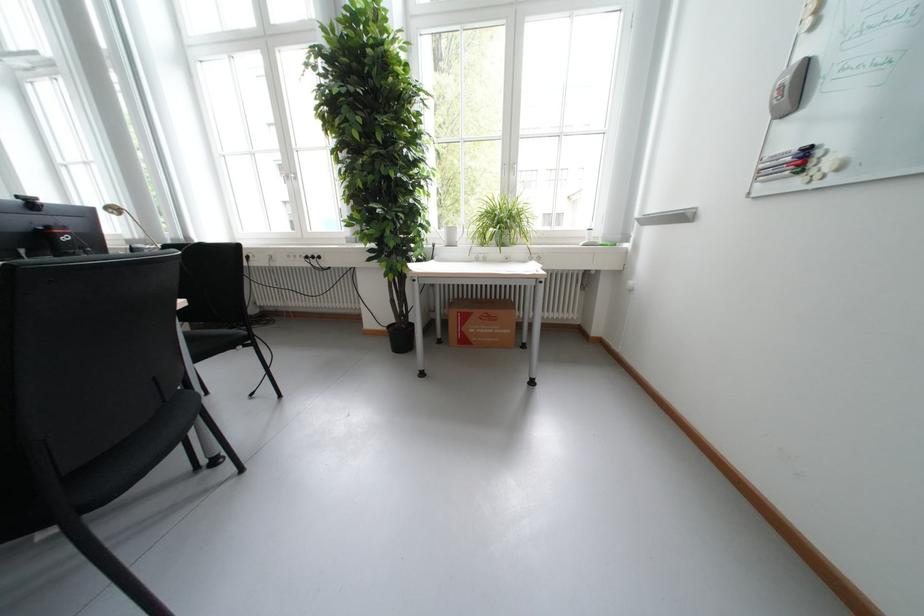
What do you see at coordinates (209, 325) in the screenshot?
I see `a chair sitting surface` at bounding box center [209, 325].